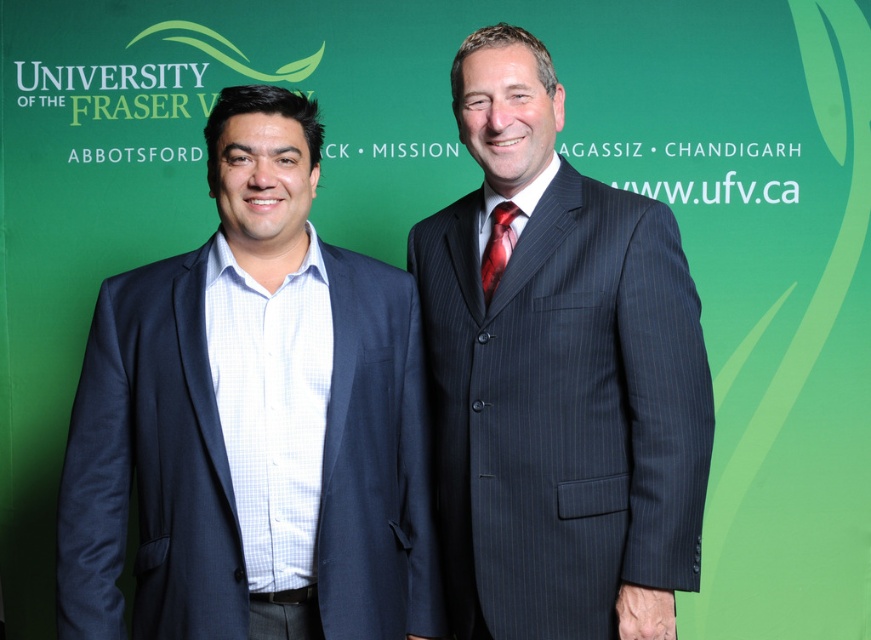
You are a photographer preparing to take a group photo of two people wearing formal attire. You notice the navy blue suit at left and the pinstriped suit at center in the scene. Based on their heights, which person should stand in the front row to ensure both are visible?

The navy blue suit at left is shorter than the pinstriped suit at center, so the person in the navy blue suit at left should stand in the front row to ensure both are visible.

You are organizing a photo shoot for a formal event and need to ensure that the two suits are spaced appropriately. Given that the navy blue suit at left is wider than the pinstriped suit at center, how should you adjust their positions to maintain a balanced appearance?

Since the navy blue suit at left is wider than the pinstriped suit at center, you should move the pinstriped suit at center slightly closer to the navy blue suit at left to balance their visual weight.